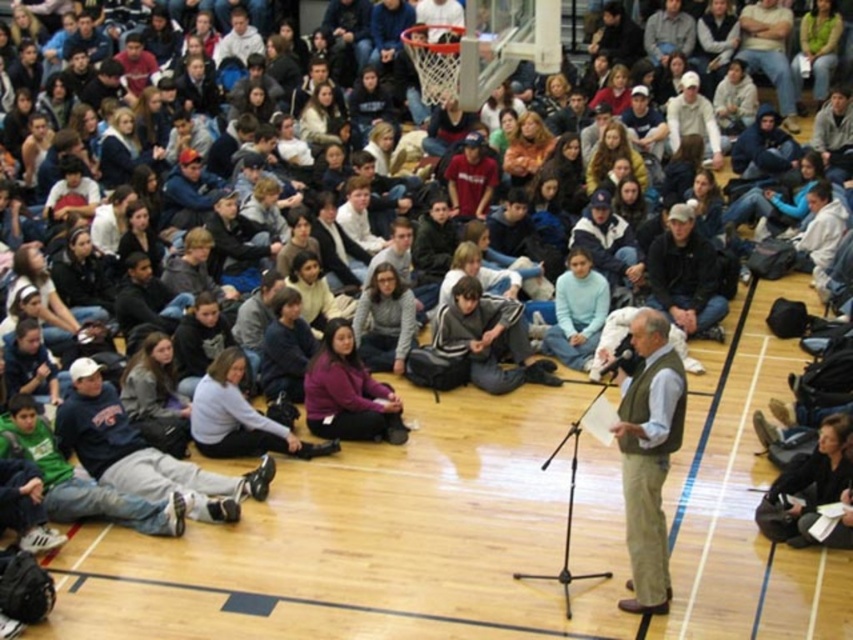
Who is higher up, green vest at center or dark gray sweater at center?

dark gray sweater at center is above.

Consider the image. Is green vest at center in front of dark gray sweater at center?

Yes, green vest at center is in front of dark gray sweater at center.

Which is behind, point (625, 452) or point (689, 214)?

Point (689, 214)

Locate an element on the screen. green vest at center is located at coordinates click(648, 456).